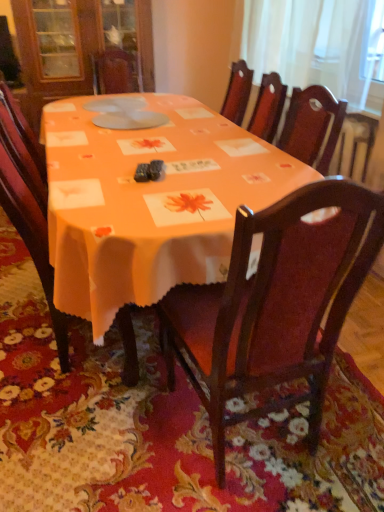
Question: Is wooden chair at center, the first chair when ordered from right to left, further to the viewer compared to white sheer curtain at upper right?

Choices:
 (A) yes
 (B) no

Answer: (B)

Question: Would you say wooden chair at center, the 2th chair when ordered from left to right, contains white sheer curtain at upper right?

Choices:
 (A) no
 (B) yes

Answer: (A)

Question: Can you confirm if wooden chair at center, the 2th chair when ordered from left to right, is bigger than white sheer curtain at upper right?

Choices:
 (A) no
 (B) yes

Answer: (B)

Question: Can you confirm if wooden chair at center, the first chair when ordered from right to left, is thinner than white sheer curtain at upper right?

Choices:
 (A) yes
 (B) no

Answer: (B)

Question: Is wooden chair at center, the first chair when ordered from right to left, with white sheer curtain at upper right?

Choices:
 (A) no
 (B) yes

Answer: (A)

Question: From a real-world perspective, is wooden chair at center, the first chair when ordered from right to left, above or below wooden chair at center, marked as the 1th chair in a left-to-right arrangement?

Choices:
 (A) above
 (B) below

Answer: (A)

Question: Relative to wooden chair at center, marked as the 1th chair in a left-to-right arrangement, is wooden chair at center, the first chair when ordered from right to left, in front or behind?

Choices:
 (A) behind
 (B) front

Answer: (B)

Question: From the image's perspective, relative to wooden chair at center, the 2th chair viewed from the right, is wooden chair at center, the first chair when ordered from right to left, above or below?

Choices:
 (A) above
 (B) below

Answer: (B)

Question: Is wooden chair at center, the first chair when ordered from right to left, bigger or smaller than wooden chair at center, the 2th chair viewed from the right?

Choices:
 (A) small
 (B) big

Answer: (B)

Question: In terms of size, does wooden chair at center, the 2th chair viewed from the right, appear bigger or smaller than white sheer curtain at upper right?

Choices:
 (A) small
 (B) big

Answer: (B)

Question: Considering the positions of point (6, 198) and point (264, 19), is point (6, 198) closer or farther from the camera than point (264, 19)?

Choices:
 (A) closer
 (B) farther

Answer: (A)

Question: In the image, is wooden chair at center, the 2th chair viewed from the right, on the left side or the right side of white sheer curtain at upper right?

Choices:
 (A) left
 (B) right

Answer: (A)

Question: Is wooden chair at center, the 2th chair viewed from the right, spatially inside white sheer curtain at upper right, or outside of it?

Choices:
 (A) inside
 (B) outside

Answer: (B)

Question: Is white sheer curtain at upper right situated inside wooden chair at center, the first chair when ordered from right to left, or outside?

Choices:
 (A) inside
 (B) outside

Answer: (B)

Question: In the image, is white sheer curtain at upper right on the left side or the right side of wooden chair at center, the first chair when ordered from right to left?

Choices:
 (A) left
 (B) right

Answer: (B)